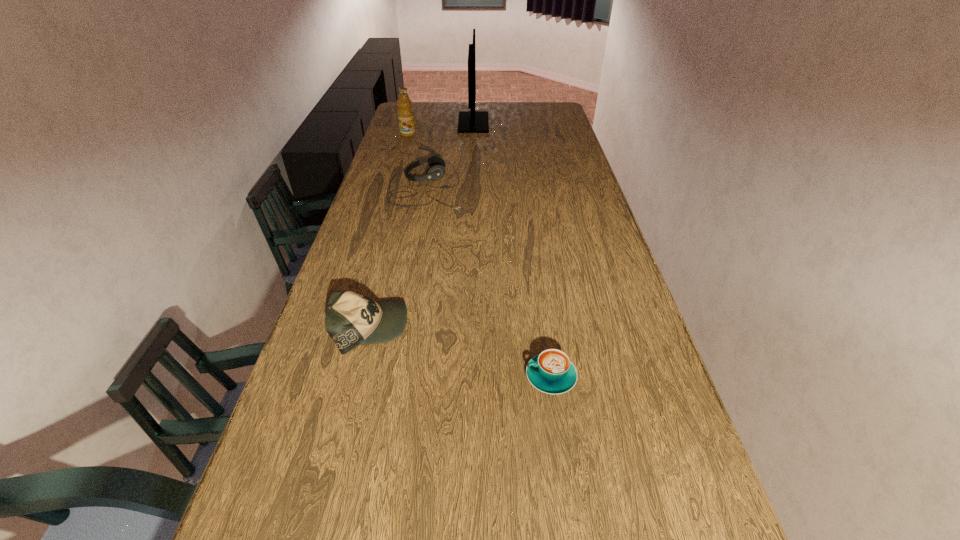
Where is `object that is the second closest one to the third farthest object`? The width and height of the screenshot is (960, 540). object that is the second closest one to the third farthest object is located at coordinates (405, 112).

In order to click on object that stands as the closest to the third nearest object in this screenshot , I will do `click(472, 121)`.

The width and height of the screenshot is (960, 540). Find the location of `vacant position in the image that satisfies the following two spatial constraints: 1. on the screen side of the monitor; 2. on the label of the olive oil`. vacant position in the image that satisfies the following two spatial constraints: 1. on the screen side of the monitor; 2. on the label of the olive oil is located at coordinates (473, 134).

The height and width of the screenshot is (540, 960). What are the coordinates of `free point that satisfies the following two spatial constraints: 1. on the screen side of the tallest object; 2. on the label of the olive oil` in the screenshot? It's located at (473, 134).